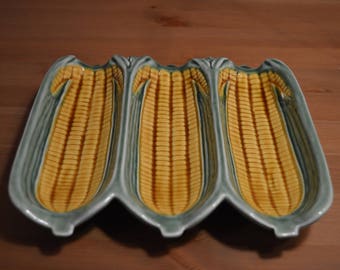
The image size is (340, 270). I want to click on tray, so click(x=87, y=157).